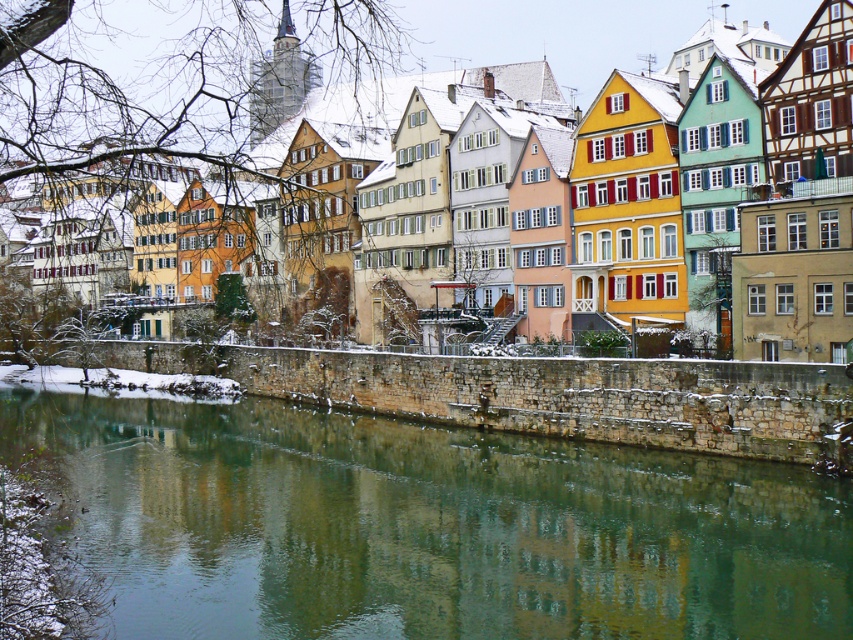
Question: Is green stone wall at lower center above wooden half-timbered houses at center?

Choices:
 (A) no
 (B) yes

Answer: (A)

Question: Does green stone wall at lower center appear on the right side of wooden half-timbered houses at center?

Choices:
 (A) no
 (B) yes

Answer: (B)

Question: Among these points, which one is nearest to the camera?

Choices:
 (A) (94, 36)
 (B) (357, 467)

Answer: (B)

Question: Which point is farther to the camera?

Choices:
 (A) (245, 36)
 (B) (799, 608)

Answer: (A)

Question: Can you confirm if green stone wall at lower center is positioned to the left of wooden half-timbered houses at center?

Choices:
 (A) no
 (B) yes

Answer: (A)